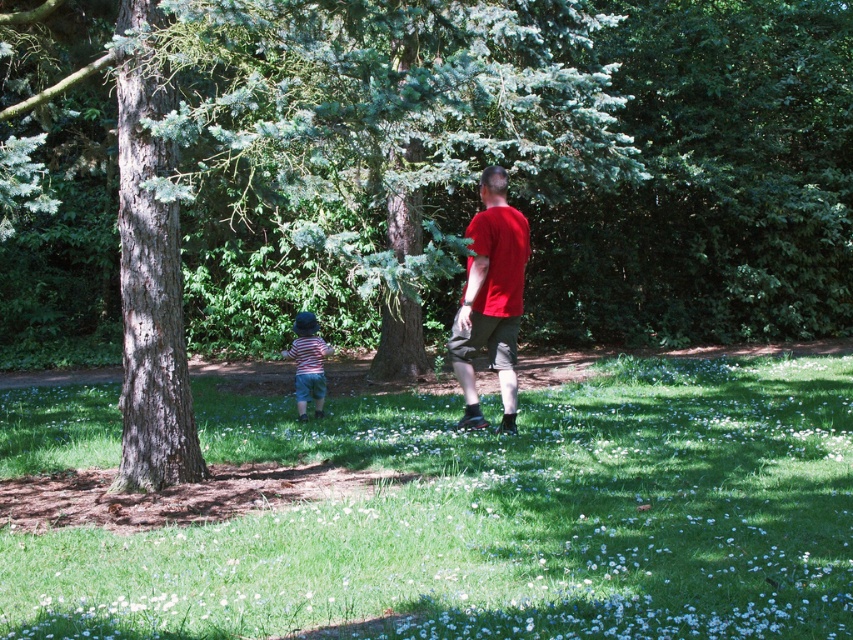
Who is more distant from viewer, (x=323, y=44) or (x=498, y=241)?

The point (x=498, y=241) is behind.

In the scene shown: Can you confirm if green textured tree at center is smaller than matte red t-shirt at center?

No, green textured tree at center is not smaller than matte red t-shirt at center.

I want to click on green textured tree at center, so click(384, 124).

Where is `green textured tree at center`? green textured tree at center is located at coordinates (384, 124).

Who is positioned more to the left, green grassy field at center or matte red t-shirt at center?

green grassy field at center

Is green grassy field at center positioned in front of matte red t-shirt at center?

Yes, green grassy field at center is in front of matte red t-shirt at center.

Who is more forward, (508, 593) or (525, 250)?

Point (508, 593)

Locate an element on the screen. The width and height of the screenshot is (853, 640). green grassy field at center is located at coordinates (500, 518).

Between point (131, 474) and point (321, 394), which one is positioned in front?

Point (131, 474) is more forward.

Which is behind, point (126, 157) or point (309, 396)?

Positioned behind is point (309, 396).

Find the location of `smooth brown tree trunk at left`. smooth brown tree trunk at left is located at coordinates (149, 275).